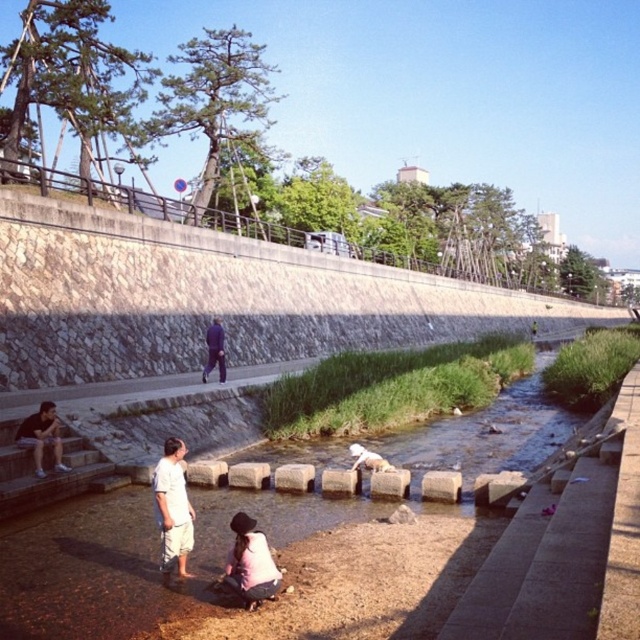
You are a delivery person with a cart that can travel 50 meters. You need to deliver a package from the stone wall at upper left to the dark blue fabric jacket at center. Can your cart reach the destination without needing a recharge?

The distance between the stone wall at upper left and the dark blue fabric jacket at center is 52.52 meters. Since your cart can only travel 50 meters, it cannot reach the destination without needing a recharge.

You are standing at the edge of the stream and want to place a small decorative rock. You have two points marked in the scene, point 1 at coordinates point (182,456) and point 2 at coordinates point (371,465). Which point is closer to you?

Point (182,456) is closer to the viewer than point (371,465), so you should place the rock at point (182,456).